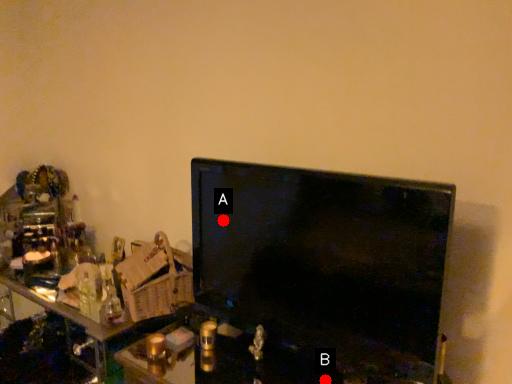
Question: Two points are circled on the image, labeled by A and B beside each circle. Which point is closer to the camera?

Choices:
 (A) A is closer
 (B) B is closer

Answer: (B)